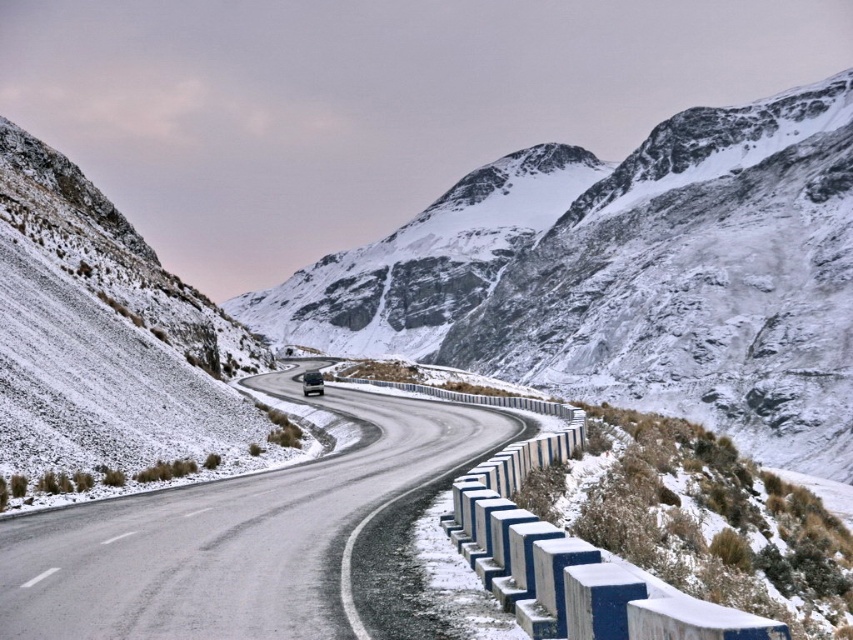
You are a driver approaching the black asphalt road at center with your dark gray metallic car at center. Can your car safely stay within the road while driving straight?

The black asphalt road at center might be wider than dark gray metallic car at center, so it is likely safe for the car to stay within the road while driving straight.

You are driving a car that requires a minimum of 150 feet to safely stop. You see the dark gray metallic car at center ahead on the black asphalt road at center. Is there enough space to stop before reaching it?

The distance between the black asphalt road at center and the dark gray metallic car at center is 148.78 feet, which is less than the required 150 feet. Therefore, there is not enough space to safely stop before reaching the dark gray metallic car at center.